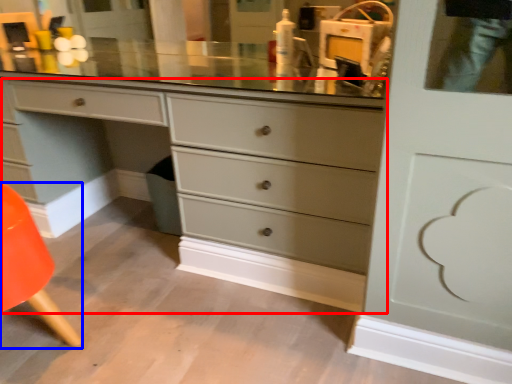
Question: Which point is further to the camera, chest of drawers (highlighted by a red box) or armchair (highlighted by a blue box)?

Choices:
 (A) chest of drawers
 (B) armchair

Answer: (A)